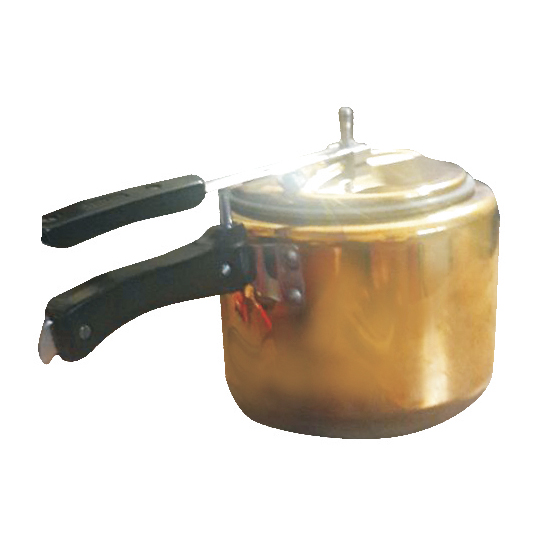
At what (x,y) coordinates should I click in order to perform the action: click on pot. Please return your answer as a coordinate pair (x, y). Looking at the image, I should click on (376, 312).